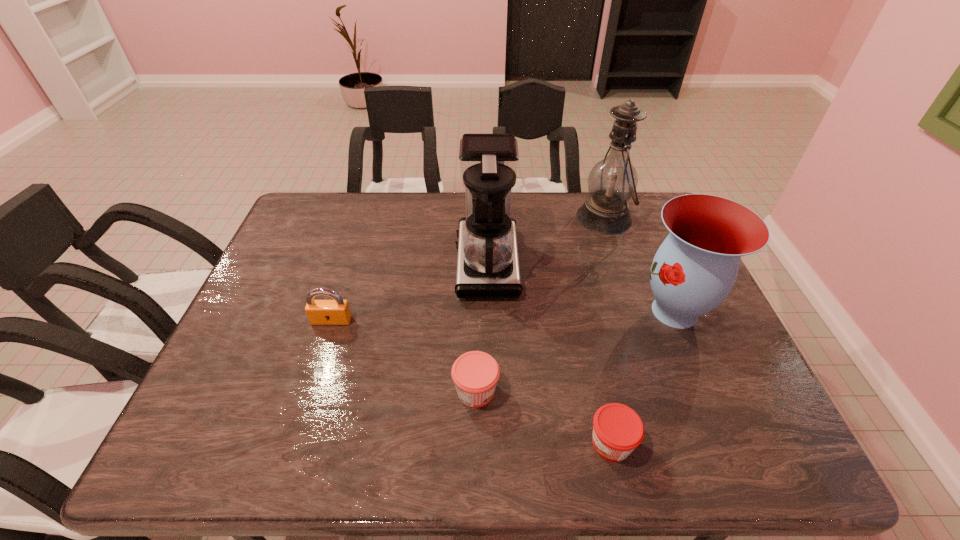
Where is `the closest object to the vase`? the closest object to the vase is located at coordinates (611, 183).

You are a GUI agent. You are given a task and a screenshot of the screen. Output one action in this format:
    pyautogui.click(x=<x>, y=<y>)
    Task: Click on the vacant area in the image that satisfies the following two spatial constraints: 1. at the front of the coffee maker where the controls are located; 2. to unlock the padlock from the front
    
    Given the screenshot: What is the action you would take?
    pyautogui.click(x=488, y=320)